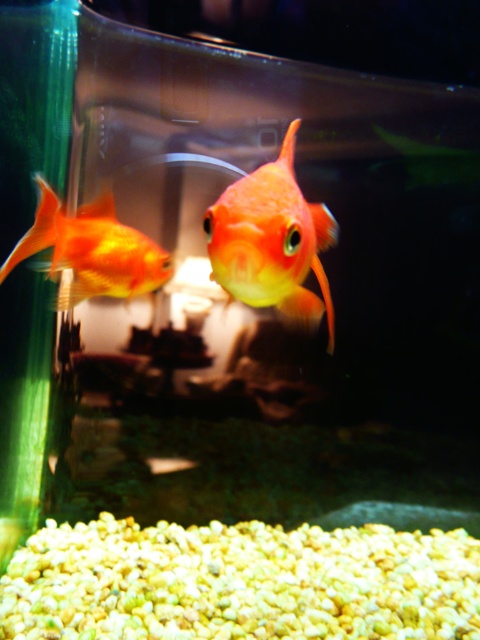
You are a small robotic fish designed to navigate the aquarium. Your starting position is at point [251,230]. You need to reach the other side of the tank, which is 1.5 meters away from your current position. Can you make it without colliding with any obstacles?

The distance between the two points is 1.05 meters, so the robotic fish can safely reach the other side of the tank without colliding with any obstacles since the required distance is shorter than the available space.

You are an aquarium caretaker checking the health of the fish. You notice the shiny orange goldfish at center and the matte orange goldfish at left. Which fish has a thinner body?

The shiny orange goldfish at center has a thinner body than the matte orange goldfish at left.

You are an aquarium enthusiast observing the shiny orange goldfish at center and the matte orange goldfish at left. Which goldfish appears taller in the image?

The shiny orange goldfish at center has a greater height compared to the matte orange goldfish at left, so it appears taller.